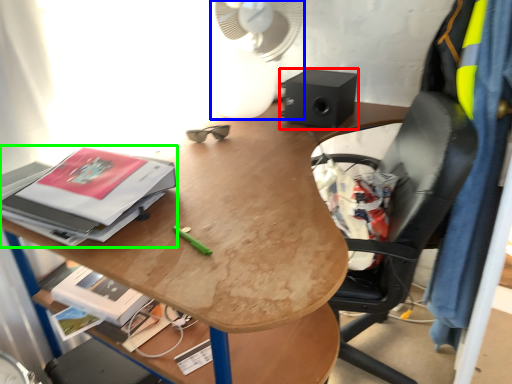
Question: Which is farther away from loudspeaker (highlighted by a red box)? mechanical fan (highlighted by a blue box) or paperback book (highlighted by a green box)?

Choices:
 (A) mechanical fan
 (B) paperback book

Answer: (B)